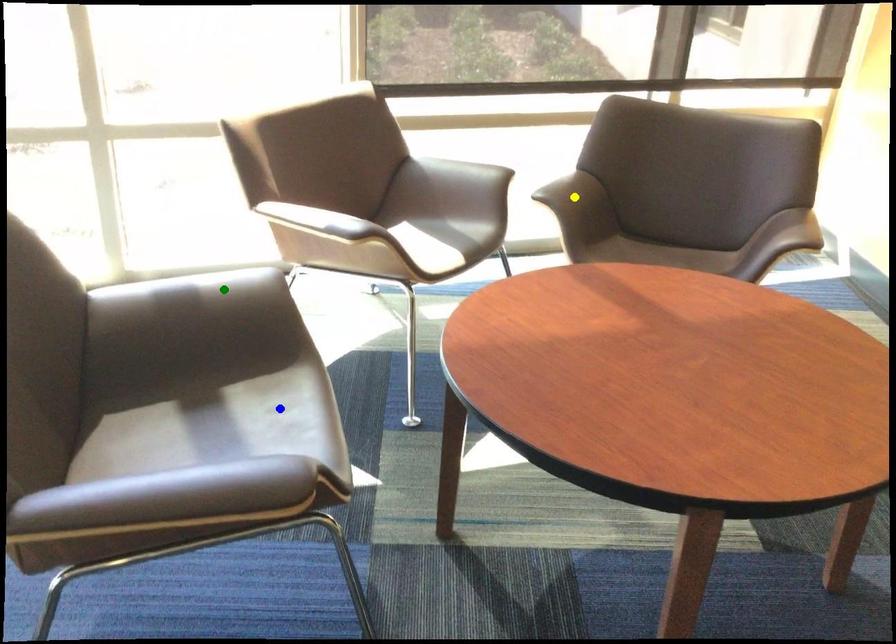
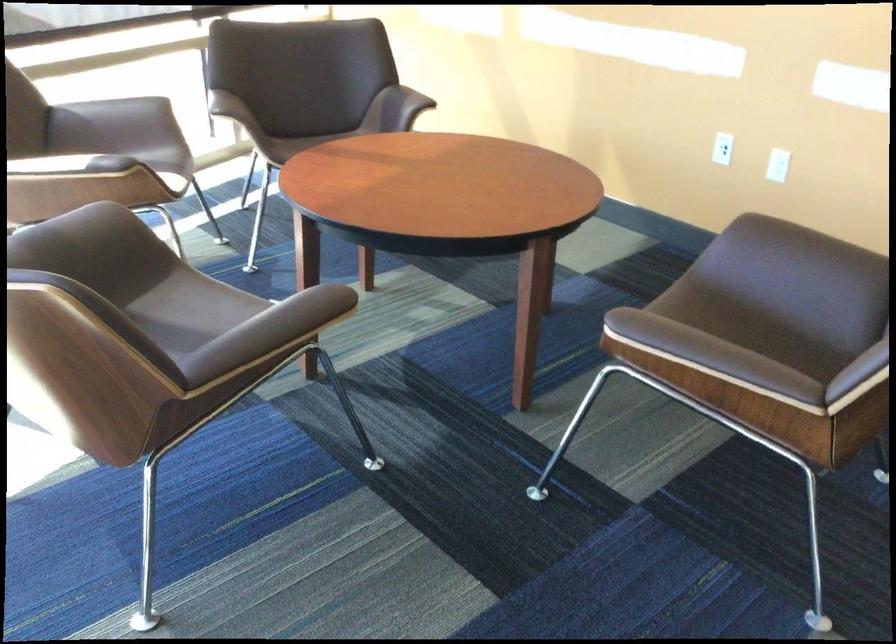
I am providing you with two images of the same scene from different viewpoints. Three points are marked in image1. Which point corresponds to a part or object that is occluded in image2?In image1, three points are marked. Which of them correspond to a part or object that is occluded in image2?Among the three points shown in image1, which one corresponds to a part or object that is no longer visible due to occlusion in image2?

yellow point cannot be seen in image2.